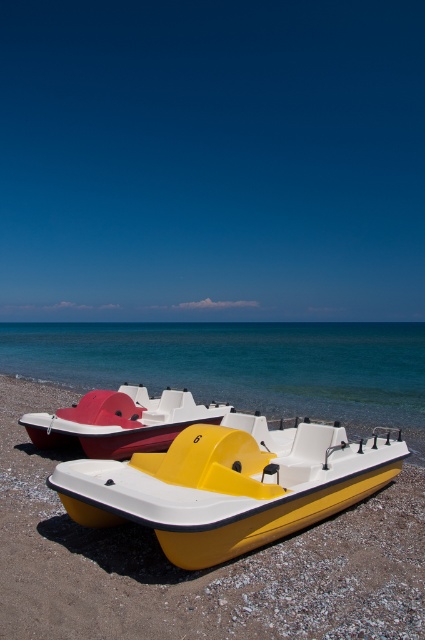
You are standing on the beach and want to take a photo of both the yellow matte pedal boat at center and the matte plastic paddle boat at lower left. Which boat should you position closer to the camera to ensure both are in frame?

You should position the yellow matte pedal boat at center closer to the camera because it is already below the matte plastic paddle boat at lower left, so moving it forward will help both boats appear in the frame without one being cut off.

You are standing on the beach and want to choose a pedal boat to ride. Which boat is easier to reach without walking too far? Please consider the yellow matte pedal boat at center and the matte plastic paddle boat at lower left.

The yellow matte pedal boat at center is closer to the viewer than the matte plastic paddle boat at lower left, so it is easier to reach without walking too far.

You are a photographer standing at the edge of the beach, aiming to capture both the yellow and red pedal boats in your shot. The yellow boat is located at point (70, 385) and the red boat is at point (91, 474). Which boat should you focus on first to ensure it appears closer in the photo?

You should focus on the yellow boat at point (70, 385) first because it is closer to the camera than the red boat at point (91, 474), making it appear nearer in the photo.